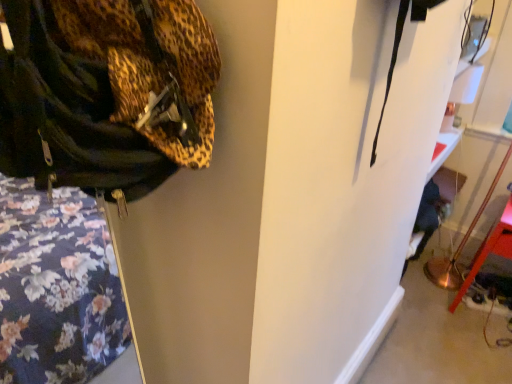
Measure the distance between point (473, 268) and camera.

Point (473, 268) is 6.37 feet away from camera.

What do you see at coordinates (489, 251) in the screenshot?
I see `metallic gold floor lamp at lower right` at bounding box center [489, 251].

Image resolution: width=512 pixels, height=384 pixels. In order to click on metallic gold floor lamp at lower right in this screenshot , I will do `click(489, 251)`.

Identify the location of metallic gold floor lamp at lower right. Image resolution: width=512 pixels, height=384 pixels. (489, 251).